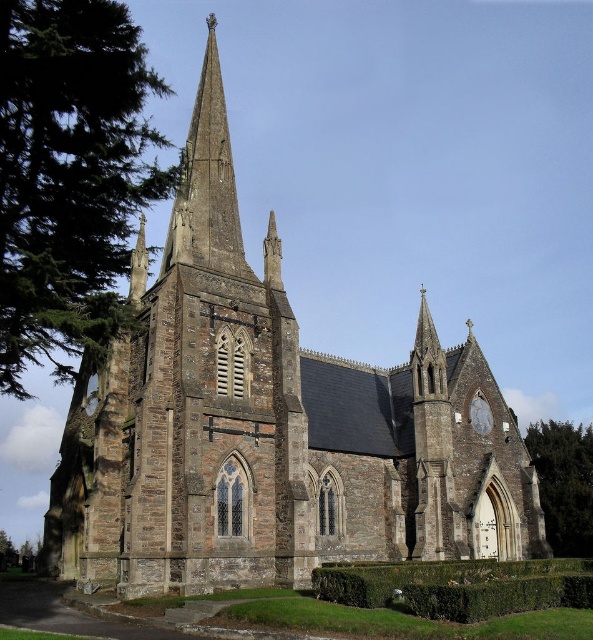
Based on the photo, you are standing in front of the Gothic church and want to take a photo that includes both the smooth stone spire at upper center and the white stone clock at upper right. Based on their positions, which object should you place on the left side of your camera frame to ensure both are visible?

The smooth stone spire at upper center is positioned on the left side of white stone clock at upper right, so you should place the smooth stone spire at upper center on the left side of your camera frame to ensure both are visible.

You are a tourist standing in front of the Gothic church. You notice a green leafy tree at lower right and a white stone clock at upper right. Which object appears bigger in the image?

The green leafy tree at lower right is larger in size than the white stone clock at upper right, so the green leafy tree at lower right appears bigger in the image.

You are standing in front of the Gothic church and want to take a photo of both the green leafy tree at lower right and the white stone clock at upper right. Which object should you frame first in your camera viewfinder to ensure both are visible?

The green leafy tree at lower right is positioned on the right side of the white stone clock at upper right, so you should frame the white stone clock at upper right first to ensure both are visible in the photo.